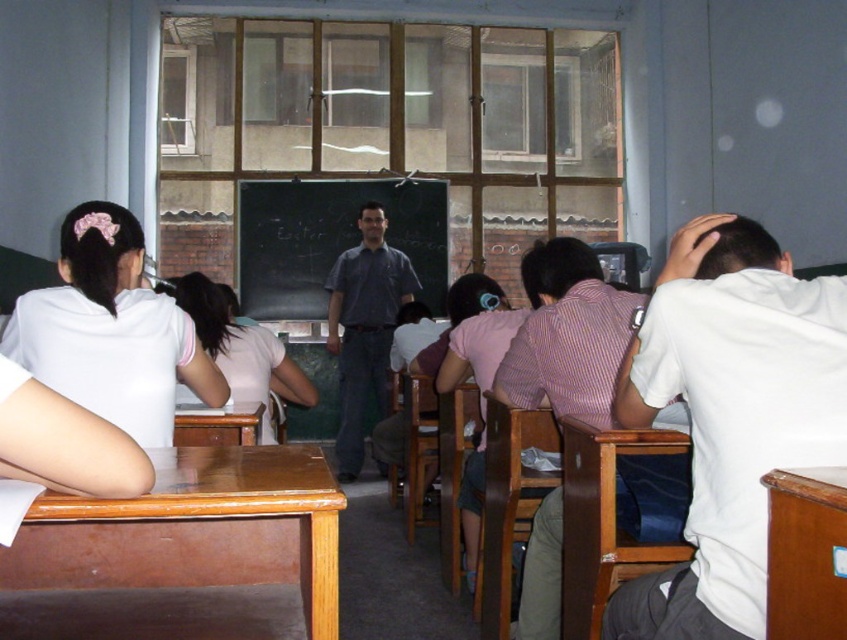
Question: Is brown polished wood table at lower left wider than brown wooden desk at lower left?

Choices:
 (A) yes
 (B) no

Answer: (A)

Question: Observing the image, what is the correct spatial positioning of black chalkboard at center in reference to wooden desk at right?

Choices:
 (A) right
 (B) left

Answer: (B)

Question: Which point is closer to the camera?

Choices:
 (A) (358, 275)
 (B) (36, 371)
 (C) (178, 417)
 (D) (668, 324)

Answer: (D)

Question: Considering the real-world distances, which object is farthest from the black chalkboard at center?

Choices:
 (A) dark blue shirt at center
 (B) white matte shirt at right
 (C) striped shirt at center

Answer: (B)

Question: Is white matte shirt at left wider than striped shirt at center?

Choices:
 (A) no
 (B) yes

Answer: (B)

Question: Which object is the farthest from the brown wooden desk at lower left?

Choices:
 (A) dark blue shirt at center
 (B) white matte shirt at right
 (C) black chalkboard at center

Answer: (C)